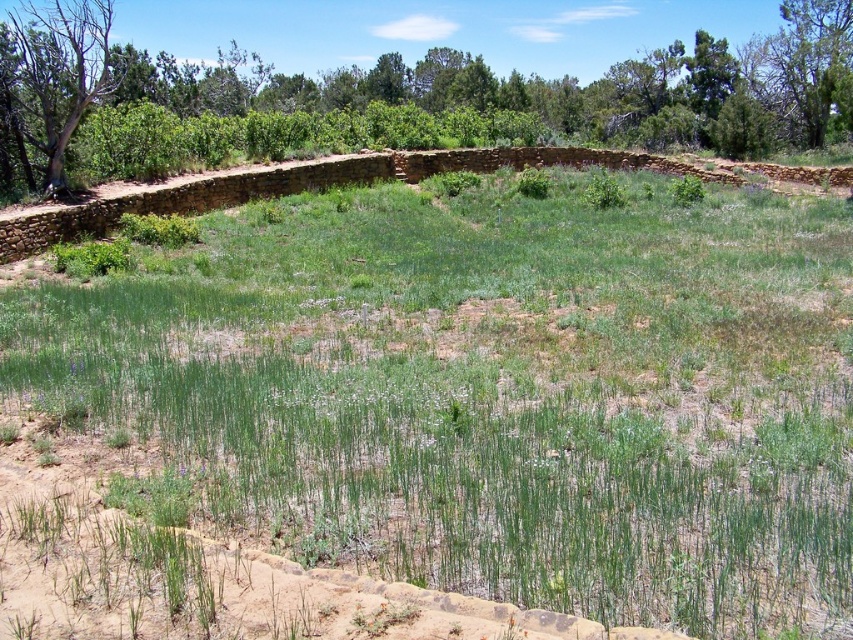
Question: Among these points, which one is nearest to the camera?

Choices:
 (A) click(537, 116)
 (B) click(740, 353)
 (C) click(808, 134)
 (D) click(67, 104)

Answer: (B)

Question: Considering the real-world distances, which object is closest to the green leafy tree at upper right?

Choices:
 (A) green leafy tree at upper left
 (B) brown bark tree at upper left
 (C) green grassy at center

Answer: (A)

Question: Does green grassy at center appear over brown bark tree at upper left?

Choices:
 (A) yes
 (B) no

Answer: (B)

Question: Among these points, which one is nearest to the camera?

Choices:
 (A) (824, 44)
 (B) (19, 32)
 (C) (135, 477)

Answer: (C)

Question: Observing the image, what is the correct spatial positioning of green grassy at center in reference to brown bark tree at upper left?

Choices:
 (A) below
 (B) above

Answer: (A)

Question: From the image, what is the correct spatial relationship of green grassy at center in relation to green leafy tree at upper right?

Choices:
 (A) right
 (B) left

Answer: (B)